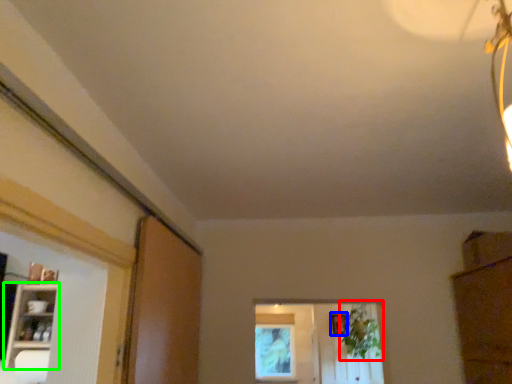
Question: Estimate the real-world distances between objects in this image. Which object is closer to plant (highlighted by a red box), picture frame (highlighted by a blue box) or shelf (highlighted by a green box)?

Choices:
 (A) picture frame
 (B) shelf

Answer: (A)